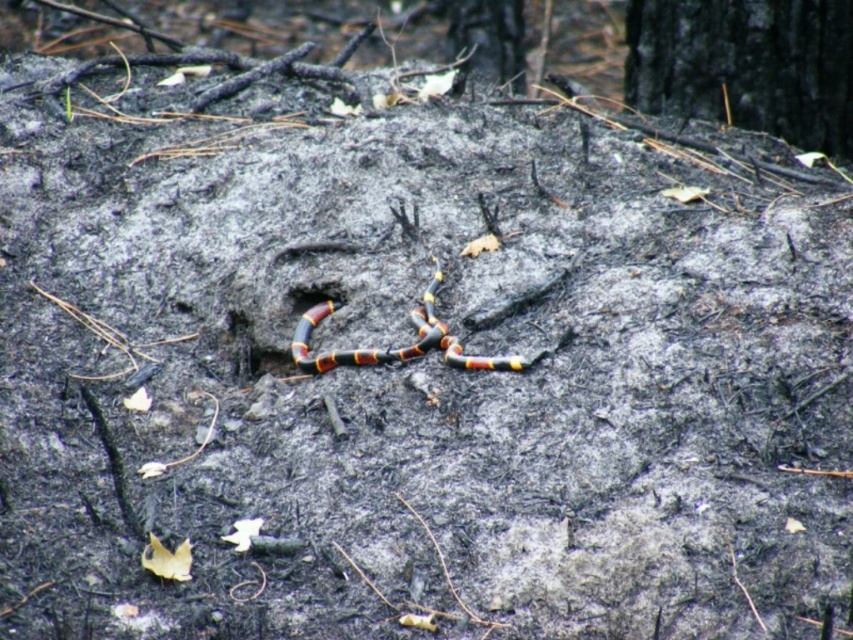
Looking at this image, can you confirm if black charred tree trunk at upper right is thinner than smooth dark brown tree trunk at upper center?

No, black charred tree trunk at upper right is not thinner than smooth dark brown tree trunk at upper center.

Between point (657, 35) and point (485, 72), which one is positioned behind?

Positioned behind is point (485, 72).

Which is in front, point (851, 49) or point (489, 4)?

Positioned in front is point (851, 49).

You are a GUI agent. You are given a task and a screenshot of the screen. Output one action in this format:
    pyautogui.click(x=<x>, y=<y>)
    Task: Click on the black charred tree trunk at upper right
    
    Given the screenshot: What is the action you would take?
    pyautogui.click(x=746, y=65)

From the picture: Between smooth dark brown tree trunk at upper center and smooth clay hole at center, which one has less height?

smooth clay hole at center is shorter.

Does smooth dark brown tree trunk at upper center appear under smooth clay hole at center?

No, smooth dark brown tree trunk at upper center is not below smooth clay hole at center.

Who is more distant from viewer, (519, 58) or (305, 285)?

Point (519, 58)

The height and width of the screenshot is (640, 853). Find the location of `smooth dark brown tree trunk at upper center`. smooth dark brown tree trunk at upper center is located at coordinates (489, 36).

Who is taller, black and orange striped snake at center or smooth dark brown tree trunk at upper center?

Standing taller between the two is smooth dark brown tree trunk at upper center.

Is black and orange striped snake at center further to the viewer compared to smooth dark brown tree trunk at upper center?

No.

You are a GUI agent. You are given a task and a screenshot of the screen. Output one action in this format:
    pyautogui.click(x=<x>, y=<y>)
    Task: Click on the black and orange striped snake at center
    The height and width of the screenshot is (640, 853).
    Given the screenshot: What is the action you would take?
    pyautogui.click(x=401, y=348)